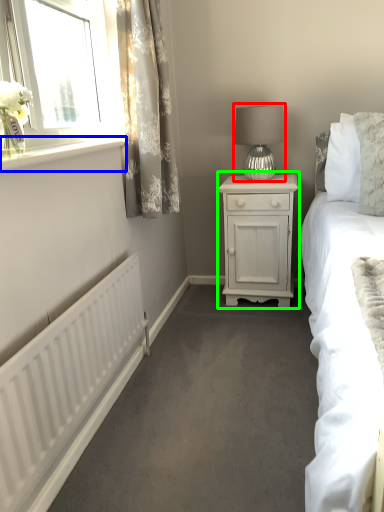
Question: Based on their relative distances, which object is nearer to table lamp (highlighted by a red box)? Choose from window sill (highlighted by a blue box) and nightstand (highlighted by a green box).

Choices:
 (A) window sill
 (B) nightstand

Answer: (B)